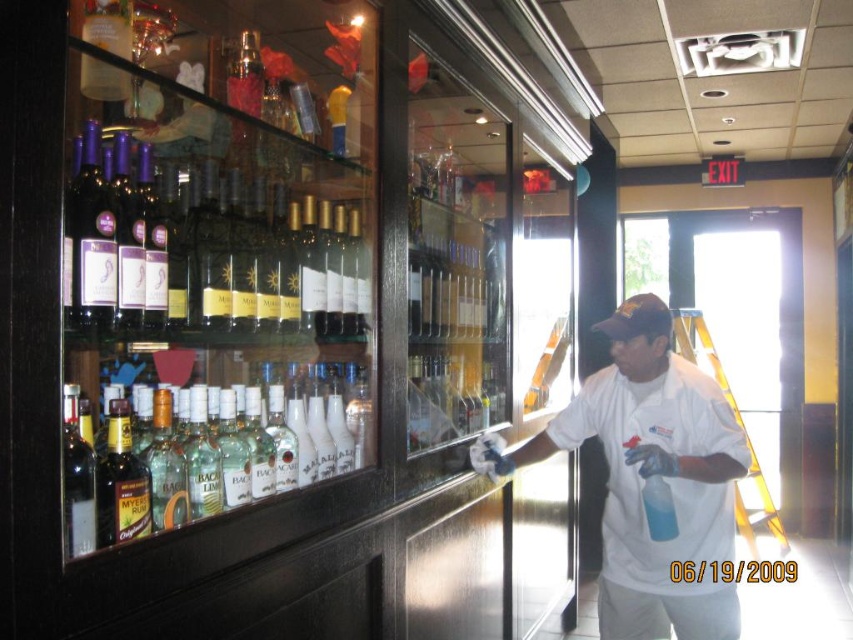
You are a customer looking at the display cabinet in the bar. You see the matte purple wine at upper left and the dark amber glass bottle at center left. Which one do you think is closer to you?

The matte purple wine at upper left is closer to you because it is in front of the dark amber glass bottle at center left.

You are a customer in the bar and want to clean your hands. You see the white cloth shirt at right and the dark amber glass bottle at center left. Which item is more suitable for cleaning your hands?

The dark amber glass bottle at center left is more suitable for cleaning your hands because it is smaller than the white cloth shirt at right, making it easier to handle for hand cleaning purposes.